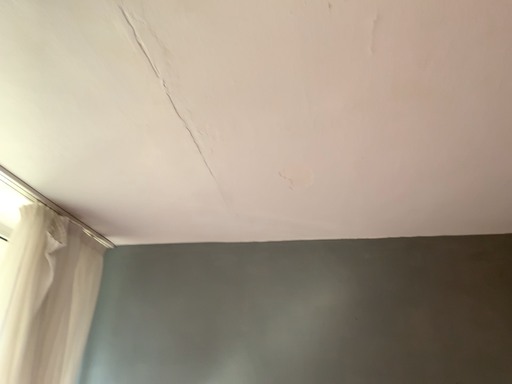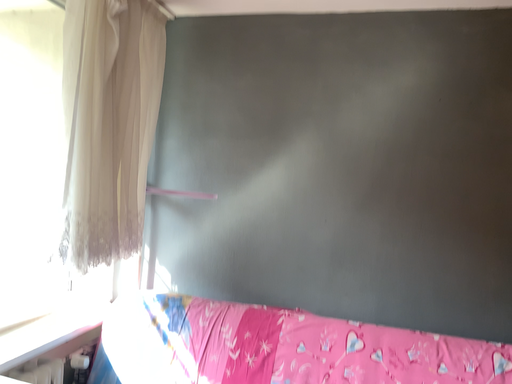
Question: How did the camera likely rotate when shooting the video?

Choices:
 (A) rotated right
 (B) rotated left

Answer: (B)